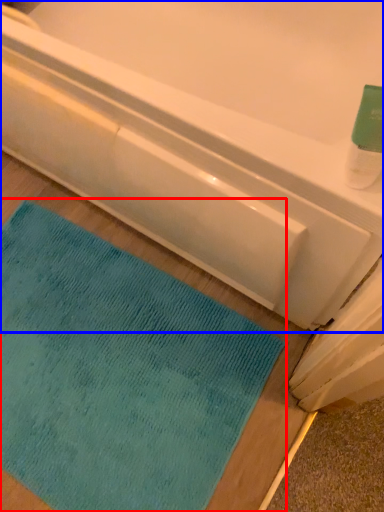
Question: Which object appears farthest to the camera in this image, mat (highlighted by a red box) or bathtub (highlighted by a blue box)?

Choices:
 (A) mat
 (B) bathtub

Answer: (A)